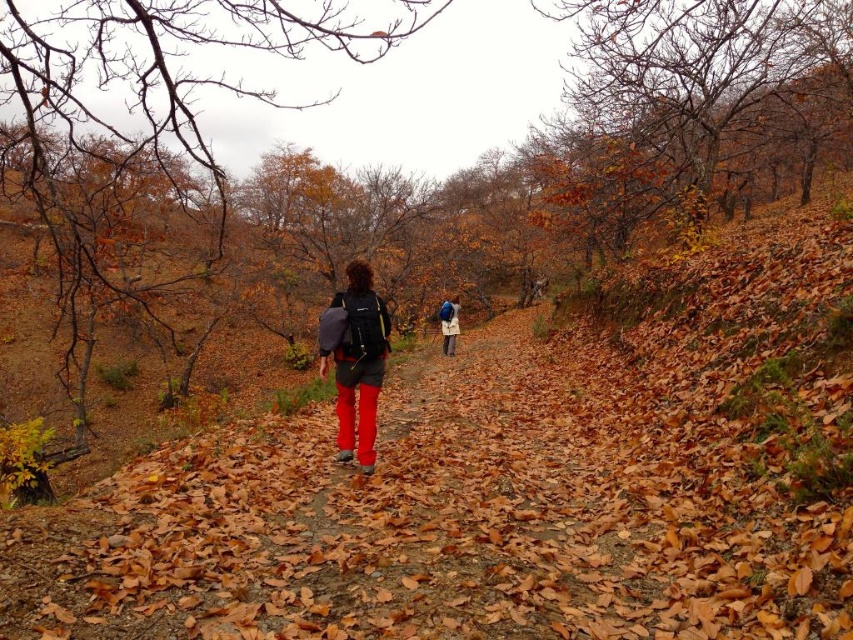
You are standing at the point labeled point [347,316] and want to walk towards the point labeled point [440,326]. Which direction should you move to get closer to your destination?

You should move away from the camera because point [440,326] is further away from the camera than point [347,316].